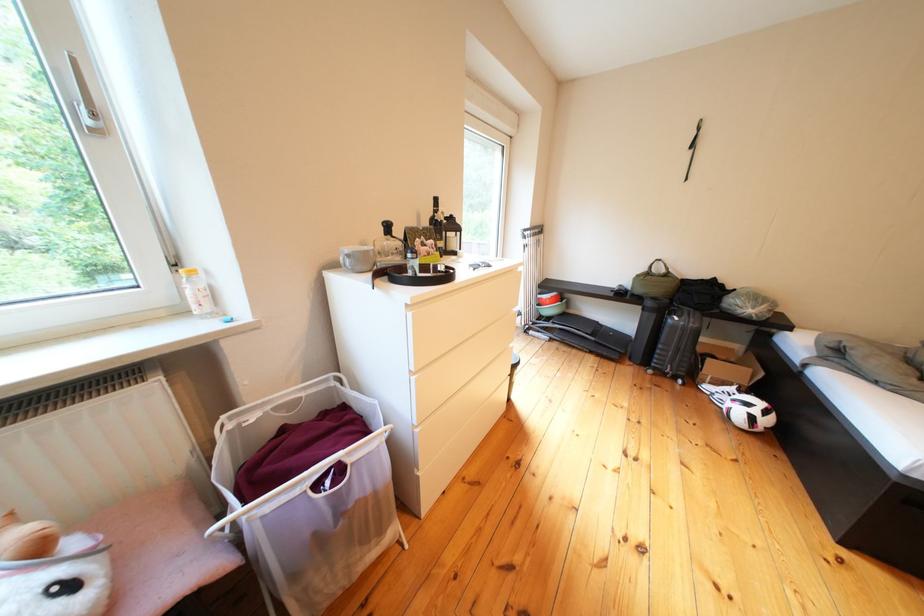
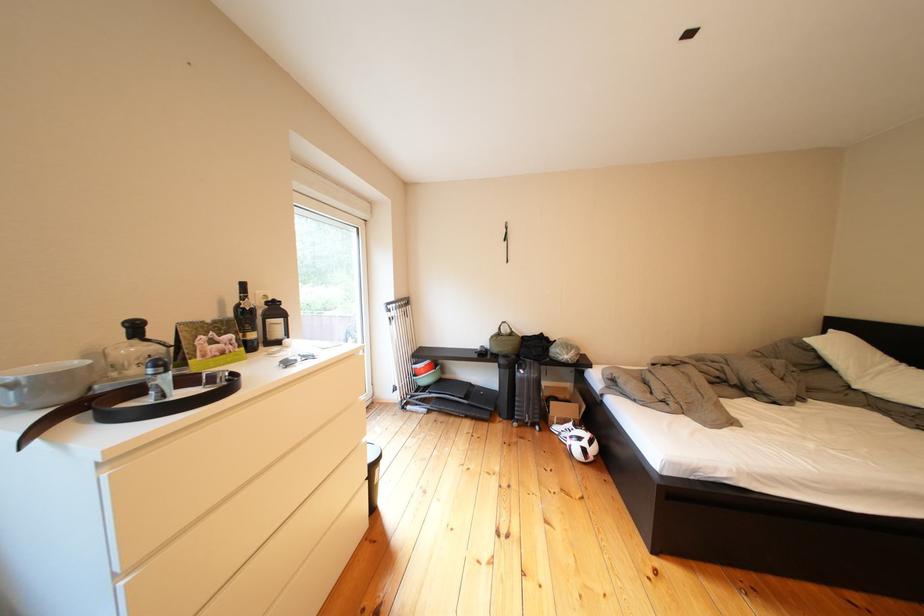
The point at (423, 318) is marked in the first image. Where is the corresponding point in the second image?

(118, 482)